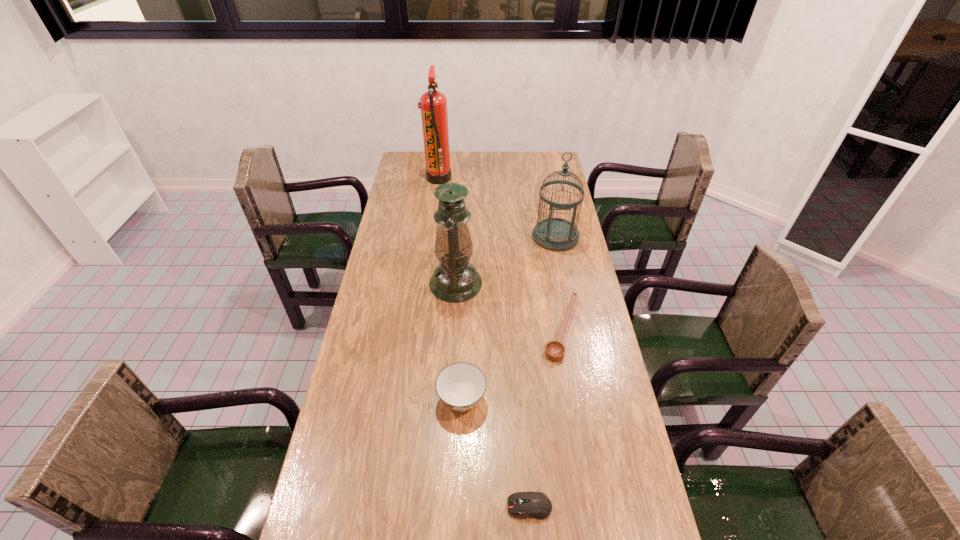
Identify the location of vacant point located between the wooden spoon and the nearest object. The height and width of the screenshot is (540, 960). (545, 417).

At what (x,y) coordinates should I click in order to perform the action: click on unoccupied area between the oil lamp and the third shortest object. Please return your answer as a coordinate pair (x, y). The height and width of the screenshot is (540, 960). Looking at the image, I should click on (459, 341).

Locate an element on the screen. The height and width of the screenshot is (540, 960). the closest object to the second nearest object is located at coordinates (555, 350).

Where is `object that stands as the fourth closest to the birdcage`? The width and height of the screenshot is (960, 540). object that stands as the fourth closest to the birdcage is located at coordinates (460, 386).

Locate an element on the screen. The width and height of the screenshot is (960, 540). free space in the image that satisfies the following two spatial constraints: 1. with the nozzle pointing from the back of the farthest object; 2. on the left side of the third shortest object is located at coordinates (410, 399).

Locate an element on the screen. free spot that satisfies the following two spatial constraints: 1. on the back side of the third shortest object; 2. on the right side of the wooden spoon is located at coordinates (464, 329).

At what (x,y) coordinates should I click in order to perform the action: click on free point that satisfies the following two spatial constraints: 1. on the back side of the second nearest object; 2. with the nozzle pointing from the back of the fire extinguisher. Please return your answer as a coordinate pair (x, y). Looking at the image, I should click on point(469,178).

Image resolution: width=960 pixels, height=540 pixels. I want to click on free spot that satisfies the following two spatial constraints: 1. with the nozzle pointing from the back of the oil lamp; 2. on the right side of the fire extinguisher, so click(x=425, y=284).